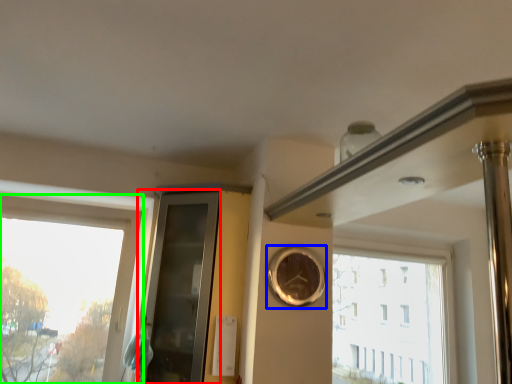
Question: Based on their relative distances, which object is farther from glass door (highlighted by a red box)? Choose from clock (highlighted by a blue box) and window (highlighted by a green box).

Choices:
 (A) clock
 (B) window

Answer: (A)